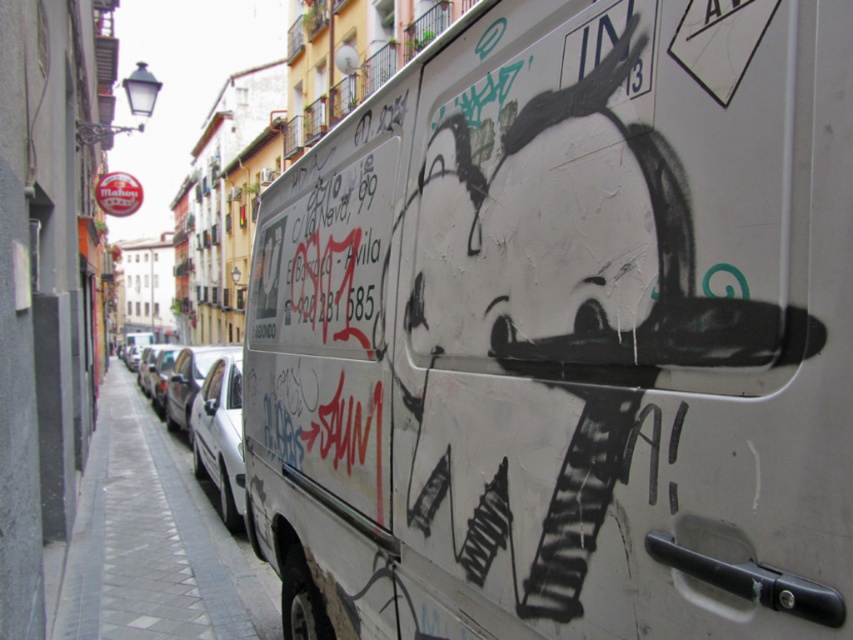
Where is `white matte van at center`? This screenshot has height=640, width=853. white matte van at center is located at coordinates (566, 333).

Who is positioned more to the right, white matte van at center or gray tile pavement at lower left?

From the viewer's perspective, white matte van at center appears more on the right side.

Which is behind, point (309, 596) or point (79, 529)?

Positioned behind is point (79, 529).

The width and height of the screenshot is (853, 640). What are the coordinates of `white matte van at center` in the screenshot? It's located at (566, 333).